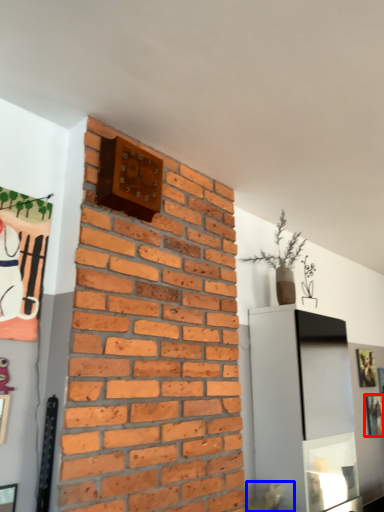
Question: Which of the following is the farthest to the observer, picture frame (highlighted by a red box) or plant (highlighted by a blue box)?

Choices:
 (A) picture frame
 (B) plant

Answer: (A)